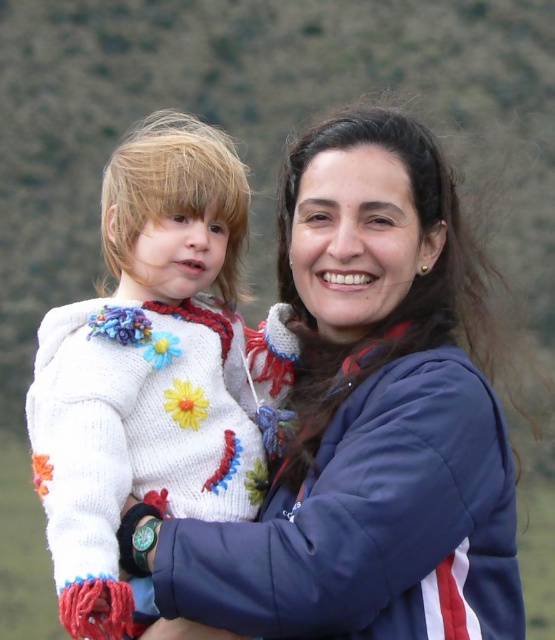
Question: Which of the following is the farthest from the observer?

Choices:
 (A) white knitted sweater at left
 (B) matte blue jacket at center

Answer: (B)

Question: Which of the following is the farthest from the observer?

Choices:
 (A) white knitted sweater at left
 (B) matte blue jacket at center

Answer: (B)

Question: Can you confirm if matte blue jacket at center is bigger than white knitted sweater at left?

Choices:
 (A) yes
 (B) no

Answer: (B)

Question: Can you confirm if matte blue jacket at center is positioned to the left of white knitted sweater at left?

Choices:
 (A) yes
 (B) no

Answer: (B)

Question: In this image, where is matte blue jacket at center located relative to white knitted sweater at left?

Choices:
 (A) left
 (B) right

Answer: (B)